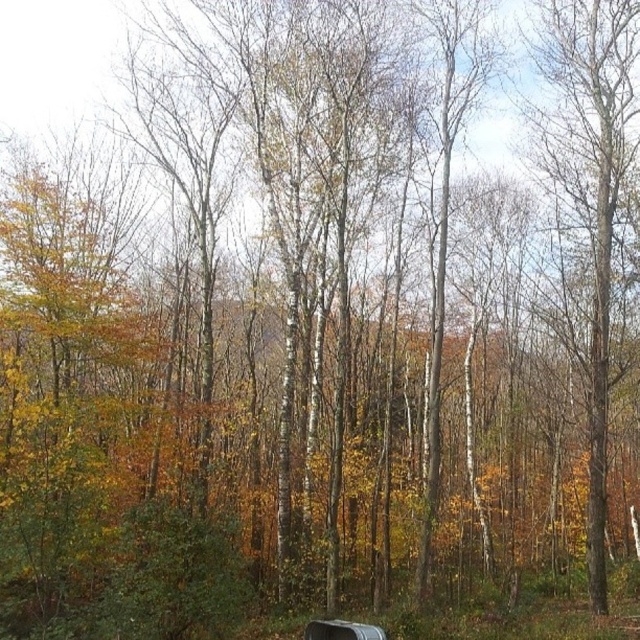
Question: Which point is farther to the camera?

Choices:
 (A) (593, 381)
 (B) (364, 632)

Answer: (A)

Question: Does smooth bark tree at right appear on the right side of metallic silver bench at lower center?

Choices:
 (A) yes
 (B) no

Answer: (A)

Question: Is smooth bark tree at right bigger than metallic silver bench at lower center?

Choices:
 (A) no
 (B) yes

Answer: (A)

Question: Which point is closer to the camera?

Choices:
 (A) metallic silver bench at lower center
 (B) smooth bark tree at right

Answer: (A)

Question: Does smooth bark tree at right appear under metallic silver bench at lower center?

Choices:
 (A) no
 (B) yes

Answer: (A)